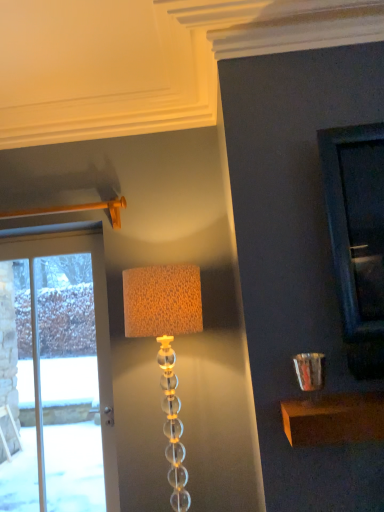
Question: Could you tell me if white glass door at left is facing translucent glass lamp at center?

Choices:
 (A) yes
 (B) no

Answer: (B)

Question: From the image's perspective, is white glass door at left on translucent glass lamp at center?

Choices:
 (A) no
 (B) yes

Answer: (A)

Question: Is translucent glass lamp at center at the back of white glass door at left?

Choices:
 (A) yes
 (B) no

Answer: (B)

Question: Can you confirm if white glass door at left is wider than translucent glass lamp at center?

Choices:
 (A) no
 (B) yes

Answer: (A)

Question: Does white glass door at left contain translucent glass lamp at center?

Choices:
 (A) yes
 (B) no

Answer: (B)

Question: Can you confirm if white glass door at left is thinner than translucent glass lamp at center?

Choices:
 (A) yes
 (B) no

Answer: (A)

Question: Is translucent glass lamp at center outside of white glass door at left?

Choices:
 (A) no
 (B) yes

Answer: (B)

Question: Is translucent glass lamp at center wider than white glass door at left?

Choices:
 (A) no
 (B) yes

Answer: (B)

Question: Considering the relative sizes of translucent glass lamp at center and white glass door at left in the image provided, is translucent glass lamp at center bigger than white glass door at left?

Choices:
 (A) yes
 (B) no

Answer: (A)

Question: Is translucent glass lamp at center facing towards white glass door at left?

Choices:
 (A) yes
 (B) no

Answer: (B)

Question: Is translucent glass lamp at center shorter than white glass door at left?

Choices:
 (A) yes
 (B) no

Answer: (A)

Question: Is translucent glass lamp at center positioned far away from white glass door at left?

Choices:
 (A) no
 (B) yes

Answer: (A)

Question: Looking at their shapes, would you say translucent glass lamp at center is wider or thinner than white glass door at left?

Choices:
 (A) wide
 (B) thin

Answer: (A)